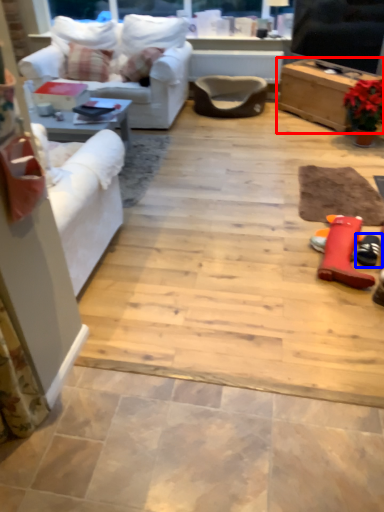
Question: Which object is closer to the camera taking this photo, table (highlighted by a red box) or footwear (highlighted by a blue box)?

Choices:
 (A) table
 (B) footwear

Answer: (B)